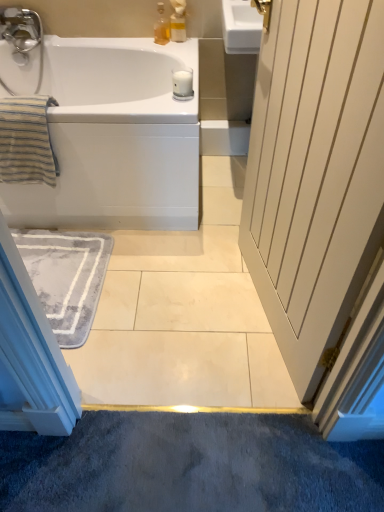
Question: Is white glossy bathtub at upper left aimed at translucent plastic soap dispenser at upper center?

Choices:
 (A) yes
 (B) no

Answer: (B)

Question: Does white glossy bathtub at upper left have a smaller size compared to translucent plastic soap dispenser at upper center?

Choices:
 (A) no
 (B) yes

Answer: (A)

Question: From a real-world perspective, does white glossy bathtub at upper left stand above translucent plastic soap dispenser at upper center?

Choices:
 (A) no
 (B) yes

Answer: (A)

Question: Considering the relative sizes of white glossy bathtub at upper left and translucent plastic soap dispenser at upper center in the image provided, is white glossy bathtub at upper left taller than translucent plastic soap dispenser at upper center?

Choices:
 (A) no
 (B) yes

Answer: (B)

Question: Does white glossy bathtub at upper left lie in front of translucent plastic soap dispenser at upper center?

Choices:
 (A) yes
 (B) no

Answer: (A)

Question: In terms of height, does striped cotton towel at left look taller or shorter compared to gray soft rug at lower left?

Choices:
 (A) tall
 (B) short

Answer: (A)

Question: Considering the positions of striped cotton towel at left and gray soft rug at lower left in the image, is striped cotton towel at left wider or thinner than gray soft rug at lower left?

Choices:
 (A) wide
 (B) thin

Answer: (B)

Question: Is striped cotton towel at left inside the boundaries of gray soft rug at lower left, or outside?

Choices:
 (A) outside
 (B) inside

Answer: (A)

Question: Is striped cotton towel at left to the left or to the right of gray soft rug at lower left in the image?

Choices:
 (A) right
 (B) left

Answer: (B)

Question: From the image's perspective, is translucent plastic soap dispenser at upper center positioned above or below gray soft rug at lower left?

Choices:
 (A) below
 (B) above

Answer: (B)

Question: Is point (175, 4) positioned closer to the camera than point (99, 246)?

Choices:
 (A) closer
 (B) farther

Answer: (B)

Question: Is translucent plastic soap dispenser at upper center in front of or behind gray soft rug at lower left in the image?

Choices:
 (A) front
 (B) behind

Answer: (B)

Question: Is translucent plastic soap dispenser at upper center bigger or smaller than gray soft rug at lower left?

Choices:
 (A) small
 (B) big

Answer: (A)

Question: From the image's perspective, is gray soft rug at lower left above or below translucent plastic bottle at upper center?

Choices:
 (A) above
 (B) below

Answer: (B)

Question: Would you say gray soft rug at lower left is to the left or to the right of translucent plastic bottle at upper center in the picture?

Choices:
 (A) left
 (B) right

Answer: (A)